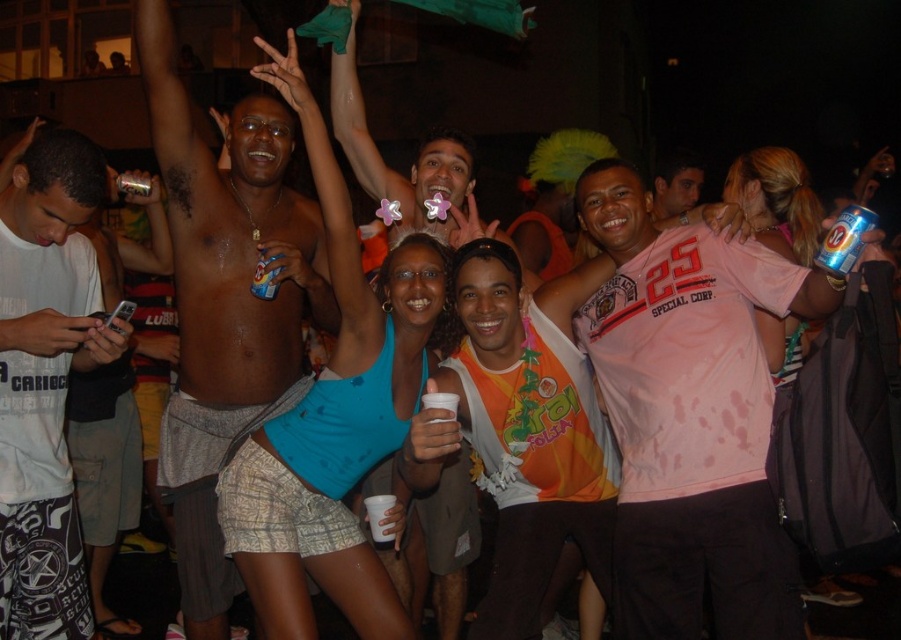
You are taking a photo of the lively nighttime scene. You want to focus on the point closer to the camera. Which point should you choose between point (276, 637) and point (426, 470)?

Point (276, 637) is closer to the camera than point (426, 470), so you should choose point (276, 637) to focus on.

You are organizing a charity event and need to display two items from the image on a shelf. The shelf has limited space. Which item from the image, the pink jersey at center or the matte pink shirt at center, would you choose to fit better on the shelf?

The pink jersey at center occupies less space than the matte pink shirt at center, so it would fit better on the shelf with limited space.